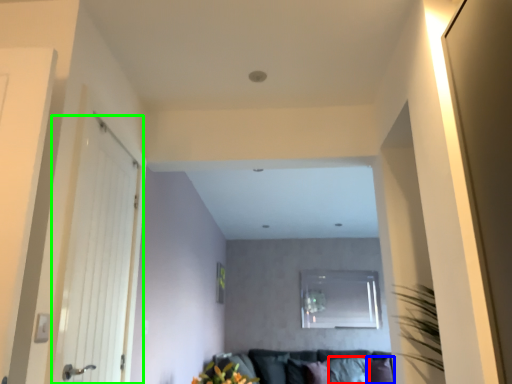
Question: Estimate the real-world distances between objects in this image. Which object is farther from pillow (highlighted by a red box), pillow (highlighted by a blue box) or door (highlighted by a green box)?

Choices:
 (A) pillow
 (B) door

Answer: (B)